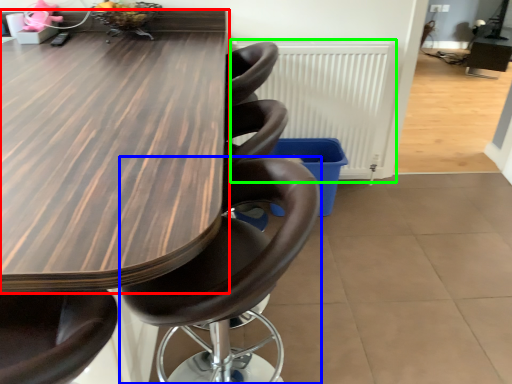
Question: Which object is positioned closest to table (highlighted by a red box)? Select from chair (highlighted by a blue box) and radiator (highlighted by a green box).

Choices:
 (A) chair
 (B) radiator

Answer: (A)